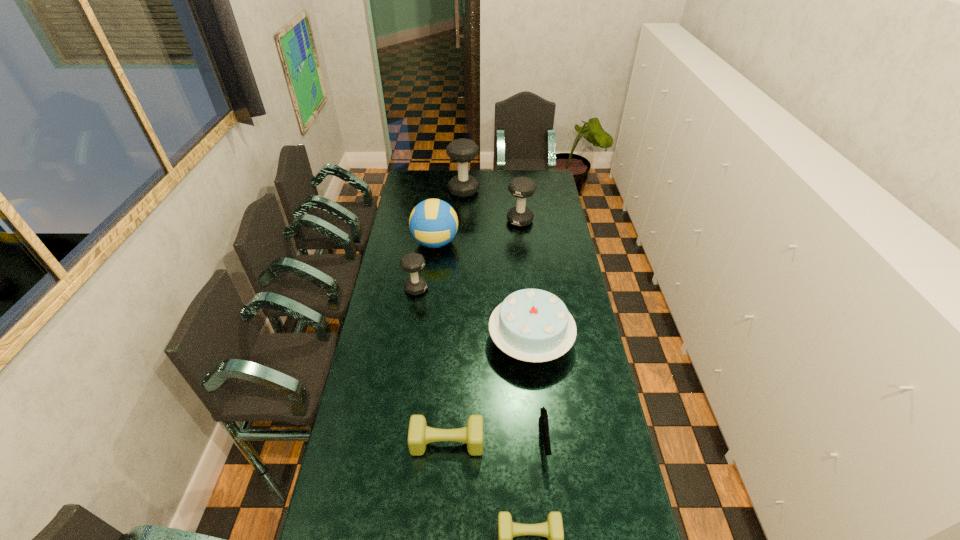
Locate an element on the screen. This screenshot has width=960, height=540. gray dumbbell that is the closest to the fifth farthest object is located at coordinates (412, 262).